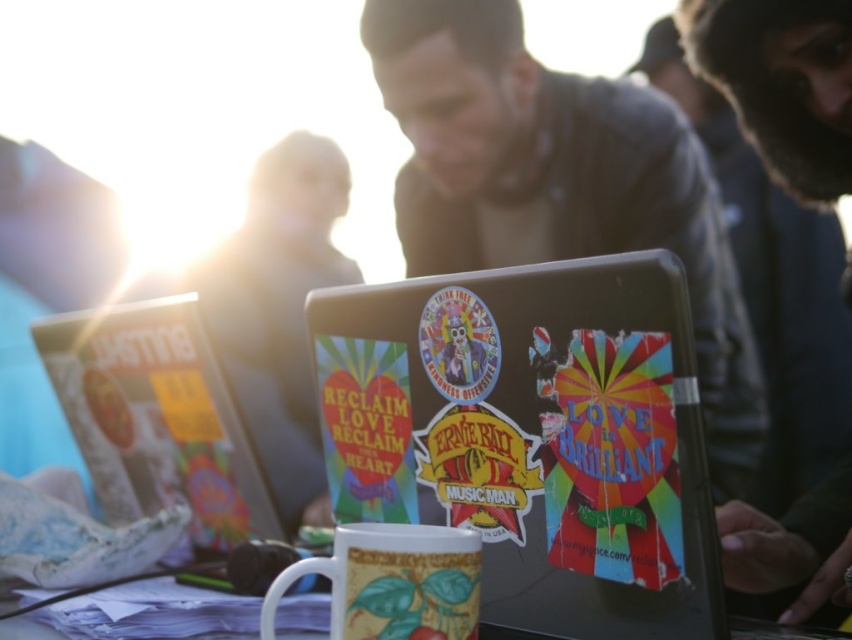
You are setting up a table for an event and need to place the multicolored stickered laptop at center and the white glossy mug at center. Which object should you place first to ensure stability?

The multicolored stickered laptop at center is taller than the white glossy mug at center, so you should place the multicolored stickered laptop at center first to avoid toppling over the mug.

You are setting up for a community event and need to place both the multicolored stickered laptop at center and the white glossy mug at lower center on a narrow shelf. The shelf can only accommodate one item. Which item should you choose to fit on the shelf?

The multicolored stickered laptop at center is wider than the white glossy mug at lower center. Since the shelf can only fit one item, you should choose the white glossy mug at lower center because it has a smaller width and is more likely to fit on the narrow shelf.

Based on the photo, you are setting up a booth at an event and need to place a white glossy mug at center on the laptop lid. The laptop lid has stickers at various positions. Where should you place the mug to avoid covering any stickers?

The white glossy mug at center is located at point (393, 582), so placing it there would avoid covering the stickers on the laptop lid.